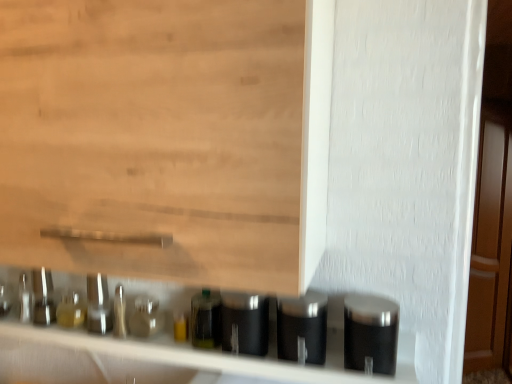
Question: Could you tell me if translucent glass bottle at center is facing black matte canisters at lower center?

Choices:
 (A) yes
 (B) no

Answer: (B)

Question: Is translucent glass bottle at center facing away from black matte canisters at lower center?

Choices:
 (A) no
 (B) yes

Answer: (A)

Question: Does translucent glass bottle at center lie behind black matte canisters at lower center?

Choices:
 (A) no
 (B) yes

Answer: (B)

Question: Does translucent glass bottle at center contain black matte canisters at lower center?

Choices:
 (A) no
 (B) yes

Answer: (A)

Question: From the image's perspective, is translucent glass bottle at center located above black matte canisters at lower center?

Choices:
 (A) yes
 (B) no

Answer: (A)

Question: In terms of width, does satin black container at right, which is the first silver in right-to-left order, look wider or thinner when compared to satin metallic canister at center, which is counted as the 1th silver, starting from the left?

Choices:
 (A) wide
 (B) thin

Answer: (B)

Question: Is point (368, 331) closer or farther from the camera than point (232, 332)?

Choices:
 (A) closer
 (B) farther

Answer: (A)

Question: From a real-world perspective, is satin black container at right, arranged as the third silver when viewed from the left, above or below satin metallic canister at center, which is counted as the 1th silver, starting from the left?

Choices:
 (A) above
 (B) below

Answer: (A)

Question: Is satin black container at right, arranged as the third silver when viewed from the left, in front of or behind satin metallic canister at center, which is counted as the 1th silver, starting from the left, in the image?

Choices:
 (A) behind
 (B) front

Answer: (B)

Question: In terms of width, does translucent glass bottle at center look wider or thinner when compared to wooden door at right?

Choices:
 (A) thin
 (B) wide

Answer: (A)

Question: Which is correct: translucent glass bottle at center is inside wooden door at right, or outside of it?

Choices:
 (A) outside
 (B) inside

Answer: (A)

Question: From the image's perspective, is translucent glass bottle at center above or below wooden door at right?

Choices:
 (A) below
 (B) above

Answer: (A)

Question: Is point tap(208, 291) positioned closer to the camera than point tap(502, 152)?

Choices:
 (A) farther
 (B) closer

Answer: (B)

Question: From the image's perspective, relative to black matte canisters at lower center, is satin silver canister at lower center, which is counted as the 2th silver, starting from the right, above or below?

Choices:
 (A) below
 (B) above

Answer: (B)

Question: Is satin silver canister at lower center, which is counted as the 2th silver, starting from the right, in front of or behind black matte canisters at lower center in the image?

Choices:
 (A) behind
 (B) front

Answer: (A)